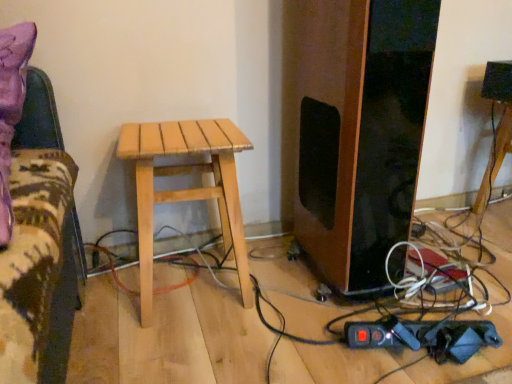
Question: From the image's perspective, is wooden stool at center on natural wood stool at center?

Choices:
 (A) yes
 (B) no

Answer: (A)

Question: Is wooden stool at center positioned behind natural wood stool at center?

Choices:
 (A) yes
 (B) no

Answer: (A)

Question: Is wooden stool at center bigger than natural wood stool at center?

Choices:
 (A) yes
 (B) no

Answer: (B)

Question: Does wooden stool at center have a greater height compared to natural wood stool at center?

Choices:
 (A) no
 (B) yes

Answer: (A)

Question: Is wooden stool at center facing towards natural wood stool at center?

Choices:
 (A) no
 (B) yes

Answer: (A)

Question: Does wooden stool at center have a lesser width compared to natural wood stool at center?

Choices:
 (A) yes
 (B) no

Answer: (A)

Question: From the image's perspective, would you say natural wood stool at center is shown under wooden stool at center?

Choices:
 (A) no
 (B) yes

Answer: (B)

Question: Considering the relative positions of natural wood stool at center and wooden stool at center in the image provided, is natural wood stool at center in front of wooden stool at center?

Choices:
 (A) no
 (B) yes

Answer: (B)

Question: Is natural wood stool at center taller than wooden stool at center?

Choices:
 (A) yes
 (B) no

Answer: (A)

Question: Is natural wood stool at center touching wooden stool at center?

Choices:
 (A) yes
 (B) no

Answer: (B)

Question: Considering the relative sizes of natural wood stool at center and wooden stool at center in the image provided, is natural wood stool at center wider than wooden stool at center?

Choices:
 (A) no
 (B) yes

Answer: (B)

Question: Would you say natural wood stool at center is outside wooden stool at center?

Choices:
 (A) no
 (B) yes

Answer: (B)

Question: In terms of width, does natural wood stool at center look wider or thinner when compared to wooden stool at center?

Choices:
 (A) wide
 (B) thin

Answer: (A)